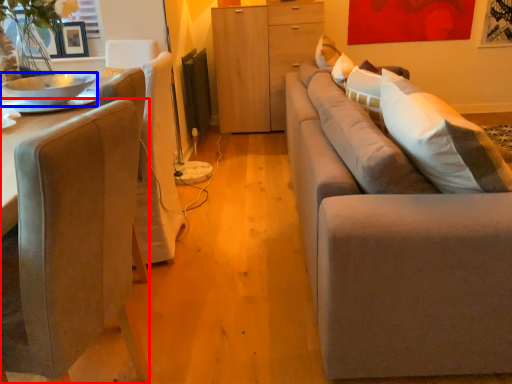
Question: Which object is closer to the camera taking this photo, chair (highlighted by a red box) or bowl (highlighted by a blue box)?

Choices:
 (A) chair
 (B) bowl

Answer: (A)